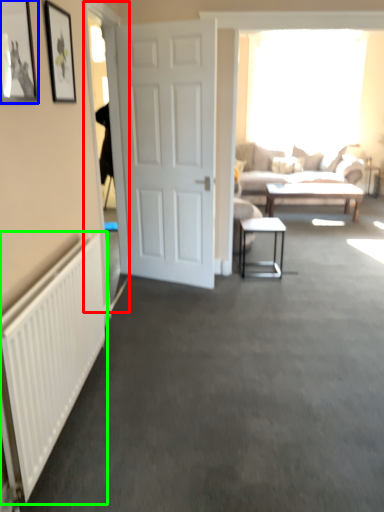
Question: Which object is positioned farthest from glass door (highlighted by a red box)? Select from picture frame (highlighted by a blue box) and radiator (highlighted by a green box).

Choices:
 (A) picture frame
 (B) radiator

Answer: (A)